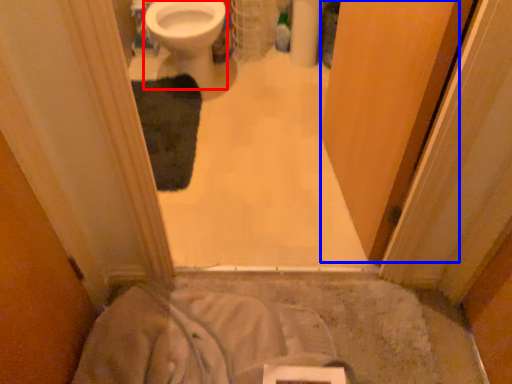
Question: Among these objects, which one is farthest to the camera, bidet (highlighted by a red box) or screen door (highlighted by a blue box)?

Choices:
 (A) bidet
 (B) screen door

Answer: (A)